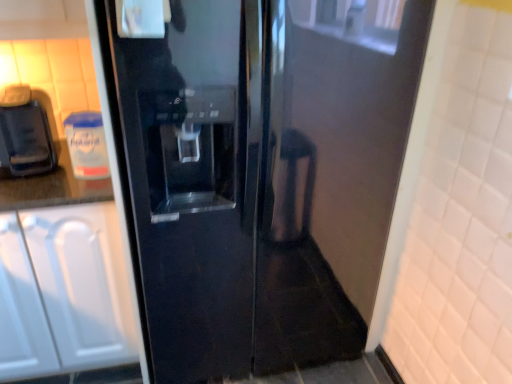
Question: From a real-world perspective, relative to glossy black refrigerator at center, is matte black coffee machine at left vertically above or below?

Choices:
 (A) below
 (B) above

Answer: (B)

Question: Would you say matte black coffee machine at left is inside or outside glossy black refrigerator at center?

Choices:
 (A) outside
 (B) inside

Answer: (A)

Question: Which object is the farthest from the matte black coffee machine at left?

Choices:
 (A) white matte cabinet at left
 (B) glossy black refrigerator at center

Answer: (B)

Question: Based on their relative distances, which object is farther from the matte black coffee machine at left?

Choices:
 (A) white matte cabinet at left
 (B) glossy black refrigerator at center

Answer: (B)